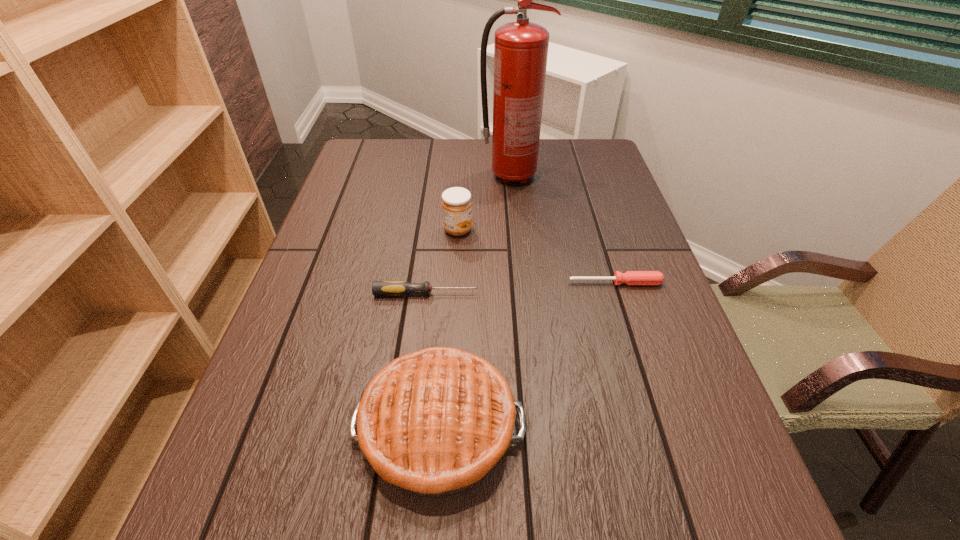
At what (x,y) coordinates should I click in order to perform the action: click on vacant space at the near left corner of the desktop. Please return your answer as a coordinate pair (x, y). The image size is (960, 540). Looking at the image, I should click on point(271,524).

Where is `empty space that is in between the tallest object and the right screwdriver`? This screenshot has height=540, width=960. empty space that is in between the tallest object and the right screwdriver is located at coordinates (564, 230).

Find the location of a particular element. This screenshot has width=960, height=540. free space between the nearest object and the jam is located at coordinates (448, 328).

Identify the location of vacant space that's between the fourth nearest object and the nearest object. Image resolution: width=960 pixels, height=540 pixels. (448, 328).

Where is `free space between the pie and the fire extinguisher`? The height and width of the screenshot is (540, 960). free space between the pie and the fire extinguisher is located at coordinates (475, 301).

The width and height of the screenshot is (960, 540). I want to click on free area in between the farther screwdriver and the nearest object, so click(x=527, y=355).

This screenshot has height=540, width=960. What are the coordinates of `unoccupied area between the nearest object and the farthest object` in the screenshot? It's located at (475, 301).

This screenshot has height=540, width=960. I want to click on vacant space that is in between the pie and the farther screwdriver, so click(x=527, y=355).

Where is `vacant space that's between the jam and the nearer screwdriver`? This screenshot has width=960, height=540. vacant space that's between the jam and the nearer screwdriver is located at coordinates (442, 261).

Locate an element on the screen. object that is the closest to the tallest object is located at coordinates (456, 203).